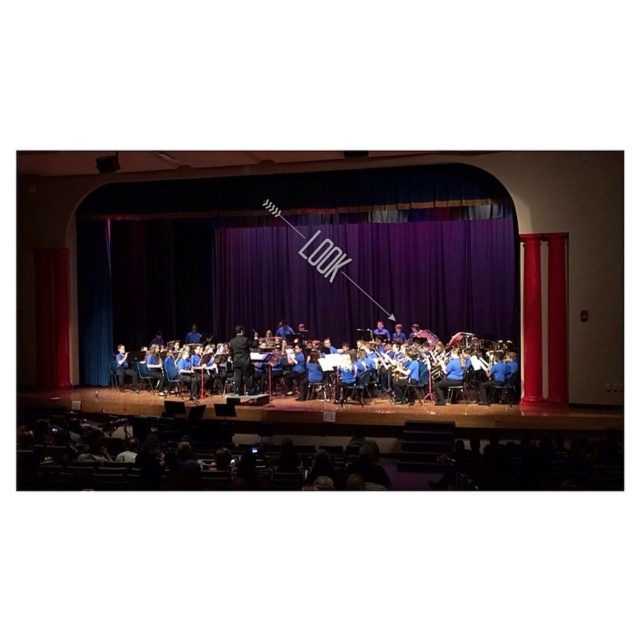
Between point (273, 369) and point (378, 365), which one is positioned behind?

Point (273, 369)

Can you confirm if blue fabric band at center is taller than blue metallic flute at center?

No, blue fabric band at center is not taller than blue metallic flute at center.

Is point (289, 337) more distant than point (364, 340)?

Yes, it is behind point (364, 340).

The image size is (640, 640). I want to click on blue fabric band at center, so click(x=330, y=368).

Who is more forward, [500,294] or [484,353]?

Point [484,353] is more forward.

Is point (474, 275) positioned behind point (484, 369)?

That is True.

Does point (152, 305) come in front of point (444, 348)?

No.

At what (x,y) coordinates should I click in order to perform the action: click on purple velvet curtain at center. Please return your answer as a coordinate pair (x, y). Image resolution: width=640 pixels, height=640 pixels. Looking at the image, I should click on (436, 272).

From the picture: Does blue fabric curtain at center have a greater width compared to purple velvet curtain at center?

Correct, the width of blue fabric curtain at center exceeds that of purple velvet curtain at center.

Between blue fabric curtain at center and purple velvet curtain at center, which one appears on the left side from the viewer's perspective?

Positioned to the left is blue fabric curtain at center.

Does point (528, 317) come behind point (115, 253)?

That is False.

The image size is (640, 640). I want to click on blue fabric curtain at center, so click(x=340, y=285).